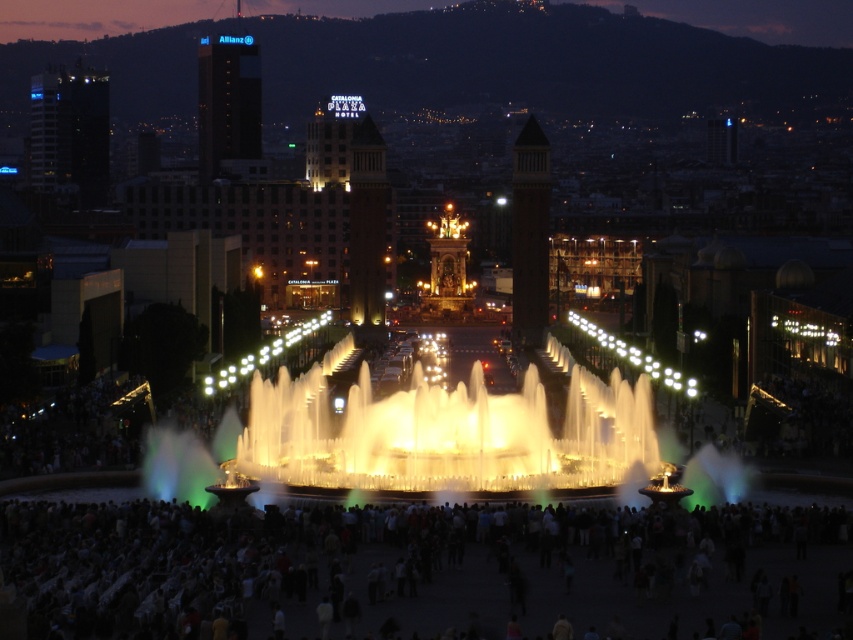
You are a photographer trying to capture the illuminated water at center in the plaza scene. However, there is a dark gray crowd at center blocking your view. Can you estimate if the crowd is large enough to fully obscure the water from your camera lens?

The dark gray crowd at center has a smaller size compared to the illuminated water at center, so the crowd is not large enough to fully obscure the water from your view.

You are a photographer trying to capture the illuminated water at center in the plaza. You notice the dark gray crowd at center might obstruct your shot. Based on the scene description, can you determine if the crowd is wider than the water feature?

The dark gray crowd at center is wider than the illuminated water at center, so it might obstruct the shot.